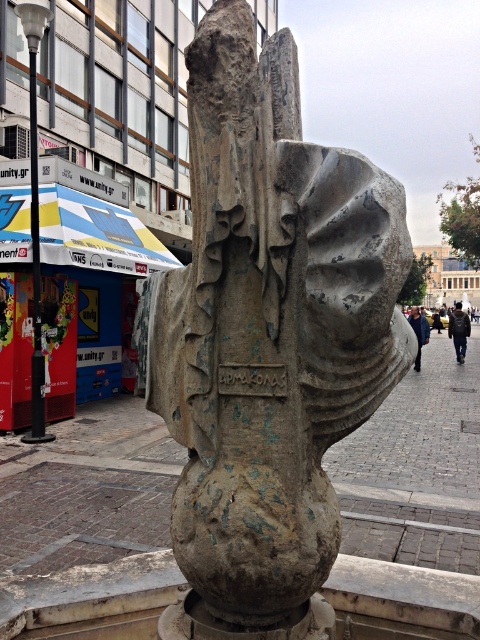
Does rusty stone sculpture at center have a greater width compared to brick pavement at center?

In fact, rusty stone sculpture at center might be narrower than brick pavement at center.

In the scene shown: Can you confirm if rusty stone sculpture at center is shorter than brick pavement at center?

Incorrect, rusty stone sculpture at center's height does not fall short of brick pavement at center's.

Identify the location of rusty stone sculpture at center. The width and height of the screenshot is (480, 640). (267, 339).